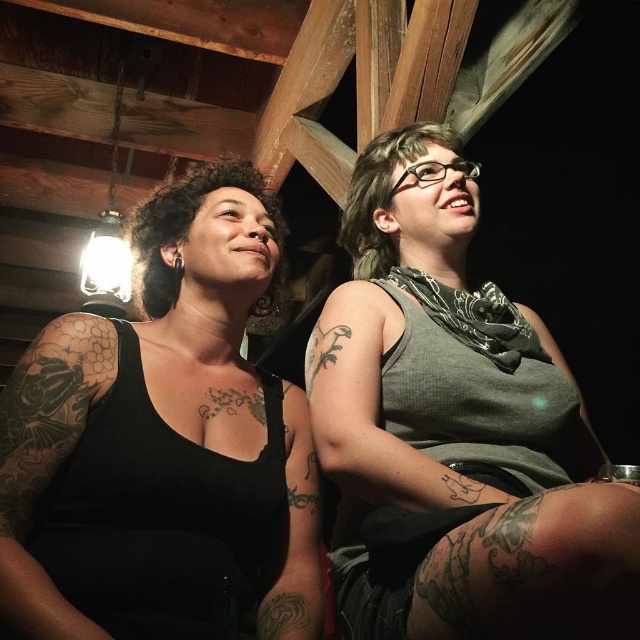
You are a photographer setting up a shoot in this cabin. You need to ensure that the gray matte tank top at center and the black tattooed arm at left are both visible in the frame. Given their sizes, which object should you focus on first to ensure it doesn

The gray matte tank top at center has a greater height compared to the black tattooed arm at left, so you should focus on the gray matte tank top at center first to ensure it is in focus before adjusting for the smaller black tattooed arm at left.

You are standing in the rustic cabin setting shown in the image. You need to place a small decorative item on one of the two specific points mentioned. Which point, either point at coordinates (625, 541) or point at coordinates (212, 289), is closer to you and thus more accessible for placing the item?

Point at coordinates (625, 541) is closer to the viewer than point at coordinates (212, 289), so it is more accessible for placing the item.

Looking at this image, you are a photographer adjusting the lighting in the scene. You notice a point at coordinates [230,371]. Which object in the scene is this point located on?

The point at coordinates [230,371] is located on the black matte tank top at left.